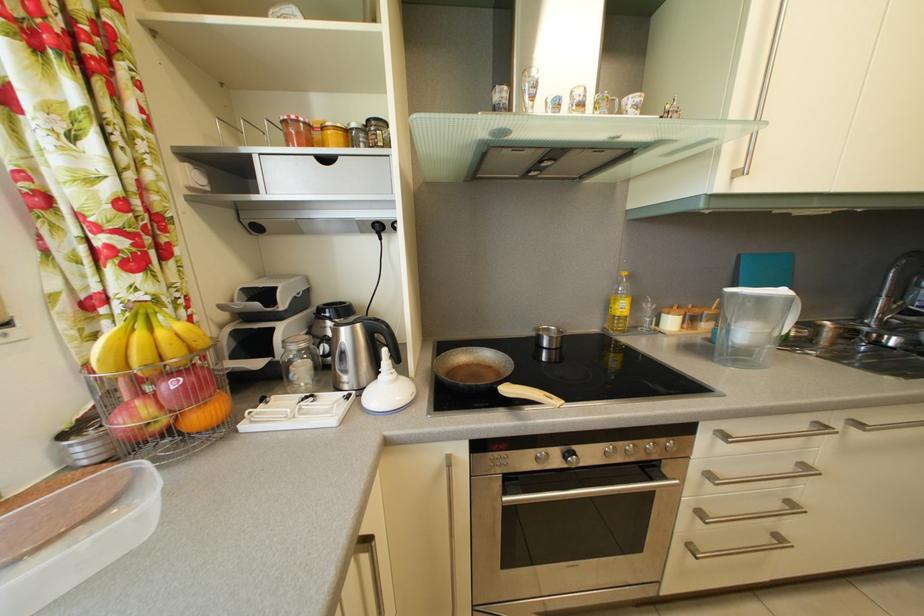
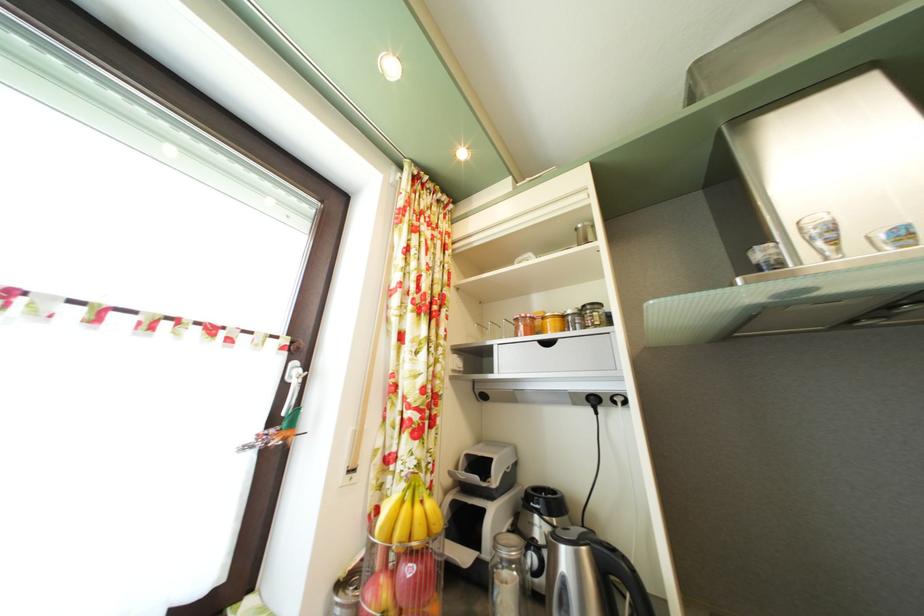
Where in the second image is the point corresponding to point 517,140 from the first image?

(821, 297)